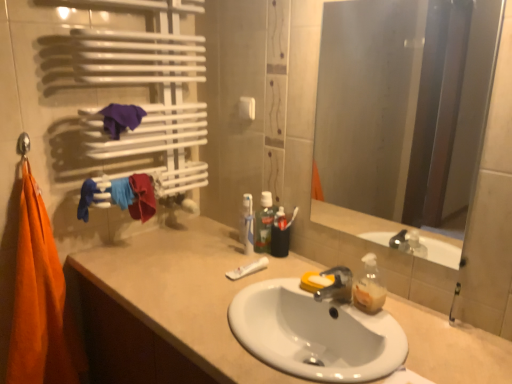
At what (x,y) coordinates should I click in order to perform the action: click on vacant space to the left of translucent plastic toothpaste at center. Please return your answer as a coordinate pair (x, y). Looking at the image, I should click on (218, 256).